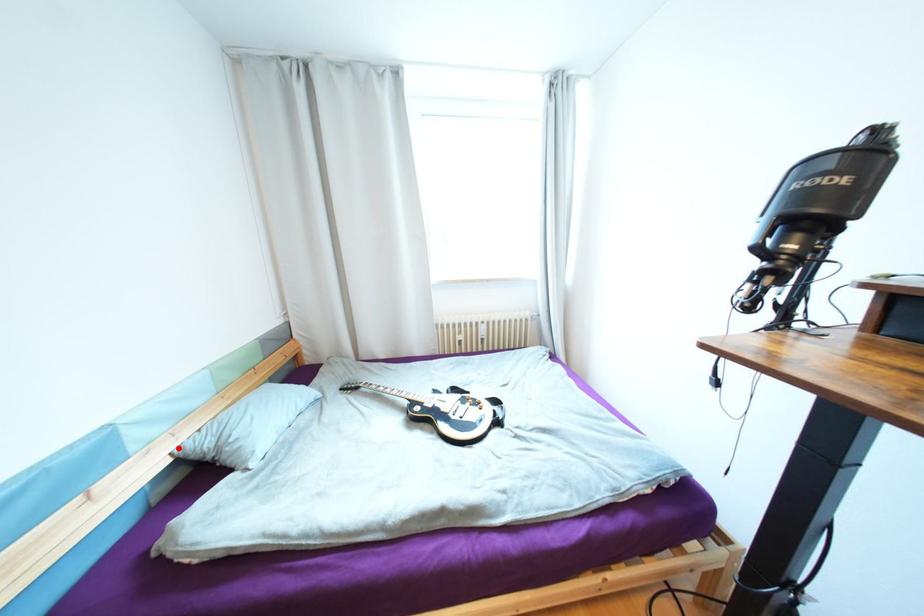
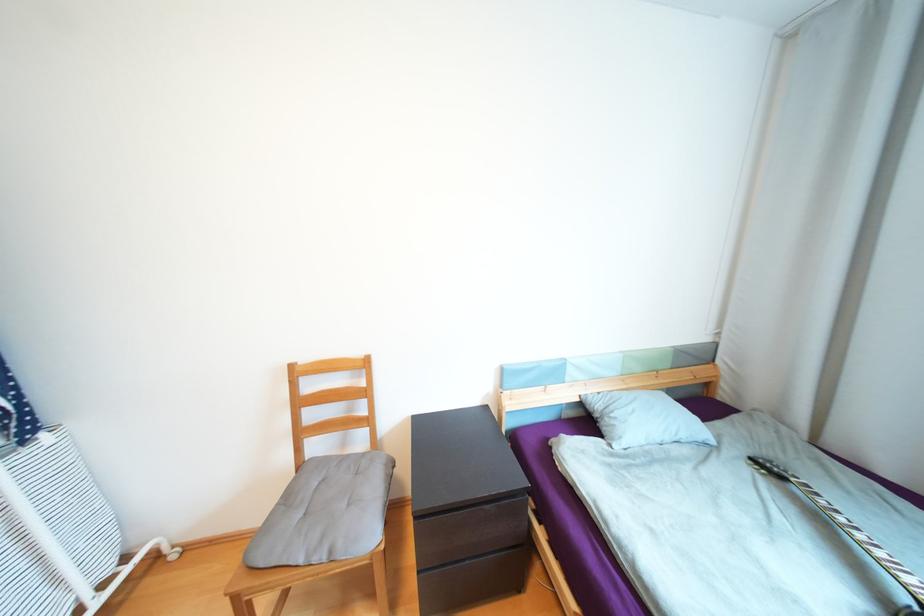
The point at the highlighted location is marked in the first image. Where is the corresponding point in the second image?

(588, 392)